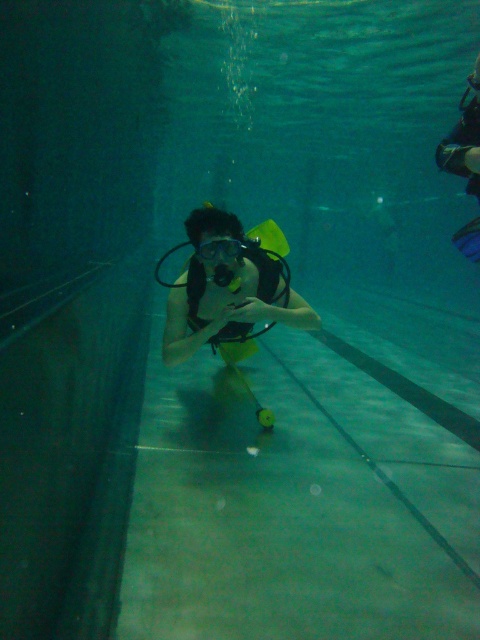
You are an underwater photographer planning to capture a shot of the diver. You notice the yellow matte scuba gear at center and the transparent plastic goggles at center. Which object should you focus on first if you want to capture the one closer to the left side of your camera frame?

The yellow matte scuba gear at center is to the left of transparent plastic goggles at center, so you should focus on the yellow matte scuba gear at center first to capture the one closer to the left side of your camera frame.

You are a lifeguard observing an underwater scene in a pool. You notice two items at the center of the image. One is the yellow matte scuba gear at center and the other is the transparent plastic goggles at center. Which item is closer to you?

The yellow matte scuba gear at center is closer to you because it is in front of the transparent plastic goggles at center.

You are an underwater photographer planning to capture a closeup shot of the yellow matte scuba gear at center and the transparent plastic goggles at center. Since you want to focus on one object, which one should you choose to ensure it fills the frame better?

The yellow matte scuba gear at center is larger in size than the transparent plastic goggles at center, so choosing the yellow matte scuba gear at center will fill the frame better.